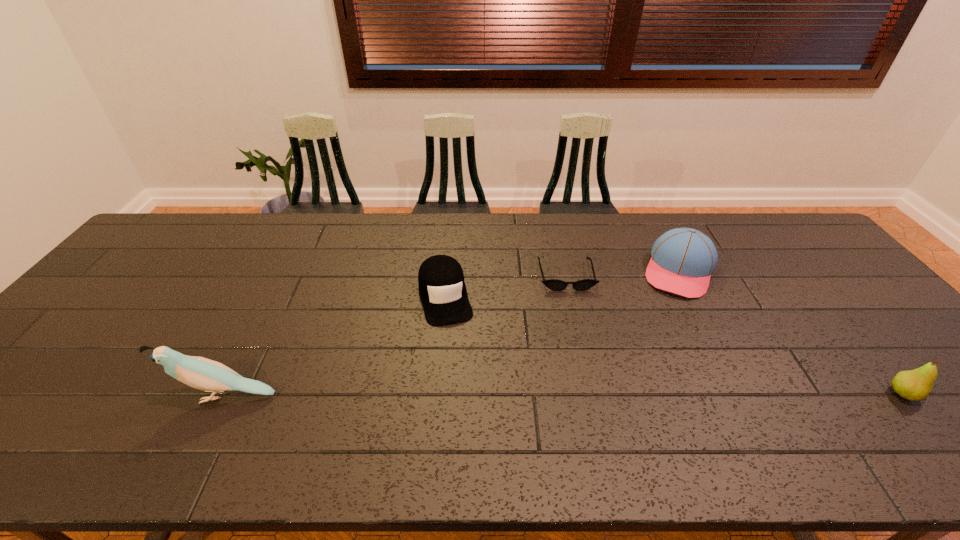
Select which object appears as the closest to the cap. Please provide its 2D coordinates. Your answer should be formatted as a tuple, i.e. [(x, y)], where the tuple contains the x and y coordinates of a point satisfying the conditions above.

[(553, 284)]

Find the location of `free space that satisfies the following two spatial constraints: 1. on the back side of the baseball cap; 2. on the right side of the fourth tallest object`. free space that satisfies the following two spatial constraints: 1. on the back side of the baseball cap; 2. on the right side of the fourth tallest object is located at coordinates (447, 271).

Locate an element on the screen. The height and width of the screenshot is (540, 960). vacant space that satisfies the following two spatial constraints: 1. on the back side of the baseball cap; 2. on the right side of the cap is located at coordinates (447, 271).

Find the location of a particular element. The height and width of the screenshot is (540, 960). vacant space that satisfies the following two spatial constraints: 1. on the front side of the second object from left to right; 2. on the right side of the rightmost object is located at coordinates (437, 394).